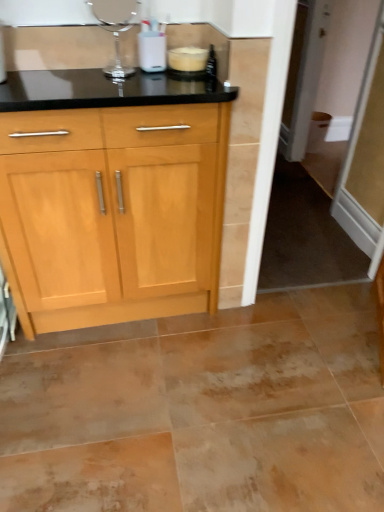
Question: From the image's perspective, is transparent glass screen door at right above or below clear glass vase at upper center, the 2th appliance in the right-to-left sequence?

Choices:
 (A) above
 (B) below

Answer: (A)

Question: Is transparent glass screen door at right to the left or to the right of clear glass vase at upper center, the 2th appliance in the right-to-left sequence, in the image?

Choices:
 (A) right
 (B) left

Answer: (A)

Question: Estimate the real-world distances between objects in this image. Which object is farther from the white plastic container at upper center, the first appliance from the right?

Choices:
 (A) transparent glass screen door at right
 (B) clear glass vase at upper center, the 2th appliance in the right-to-left sequence

Answer: (A)

Question: Estimate the real-world distances between objects in this image. Which object is farther from the clear glass vase at upper center, the 2th appliance in the right-to-left sequence?

Choices:
 (A) transparent glass screen door at right
 (B) white plastic container at upper center, the first appliance from the right

Answer: (A)